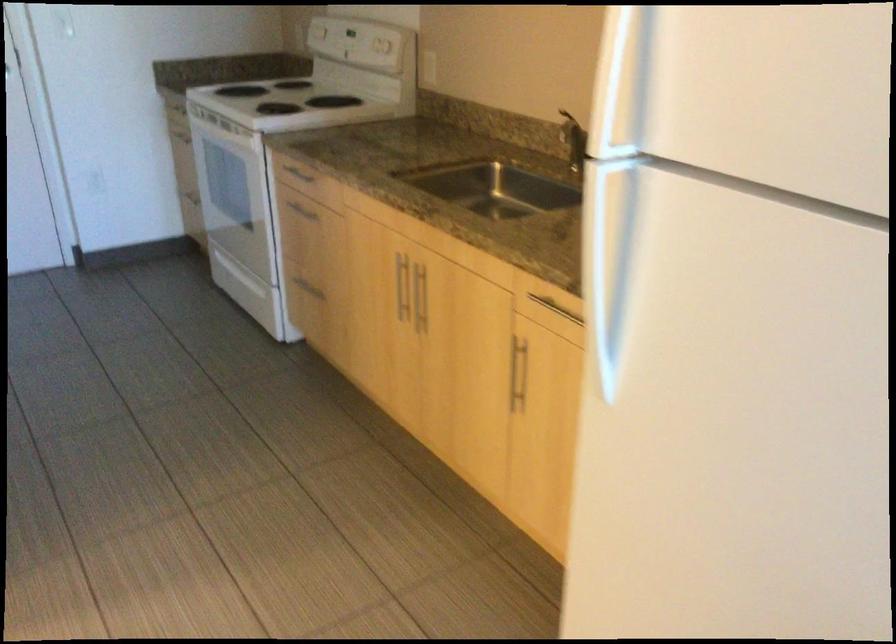
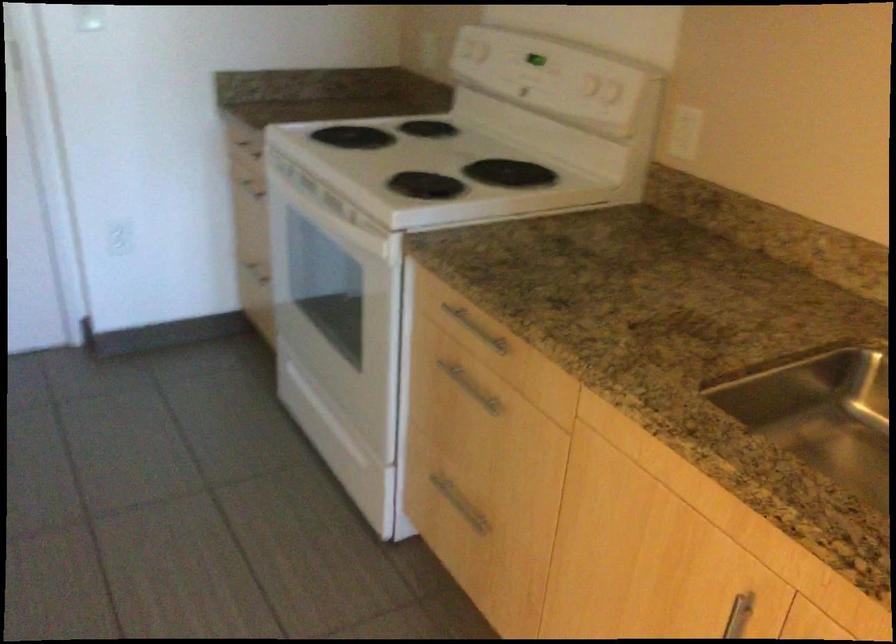
Which direction would the cameraman need to move to produce the second image?

The movement direction of the cameraman is left, forward.